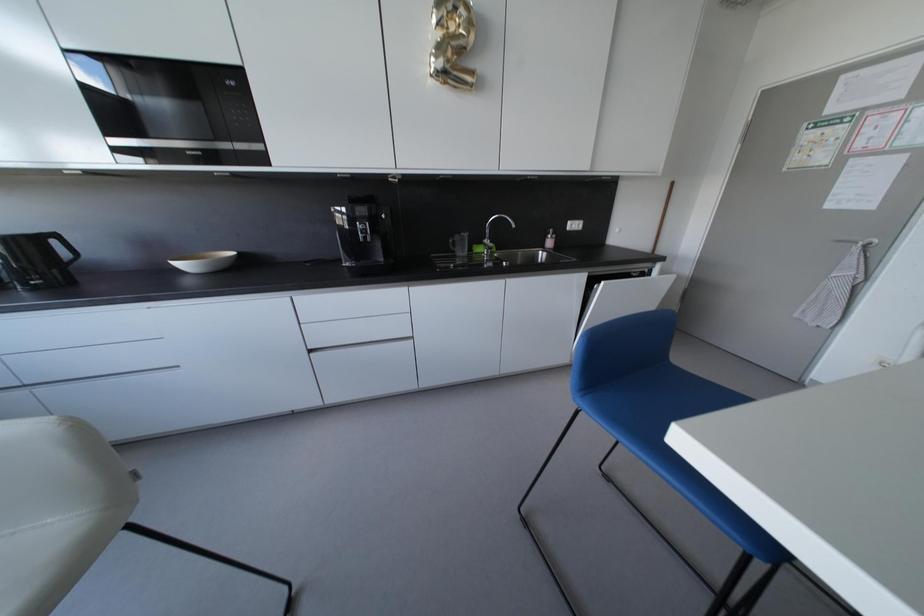
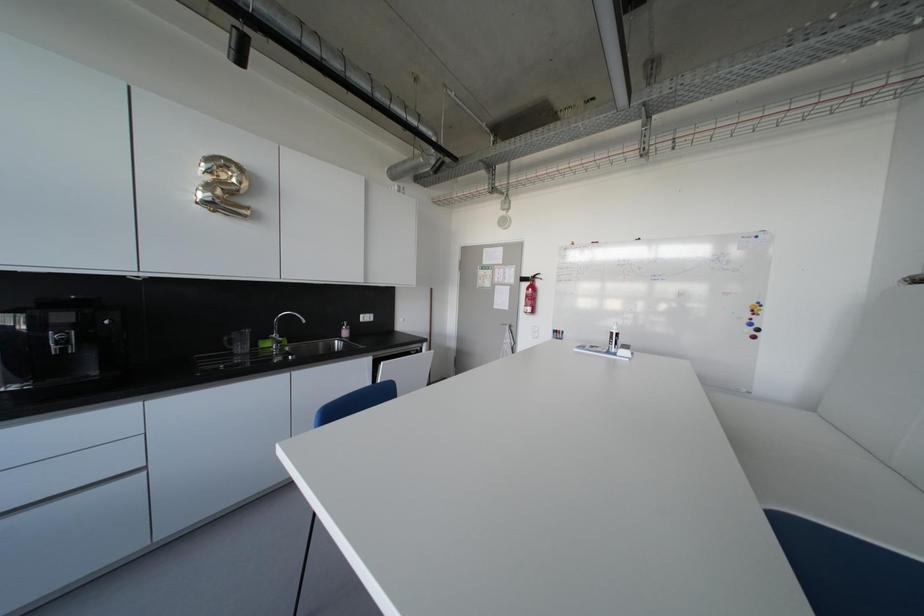
Question: The images are taken continuously from a first-person perspective. In which direction is your viewpoint rotating?

Choices:
 (A) Left
 (B) Right
 (C) Up
 (D) Down

Answer: (B)